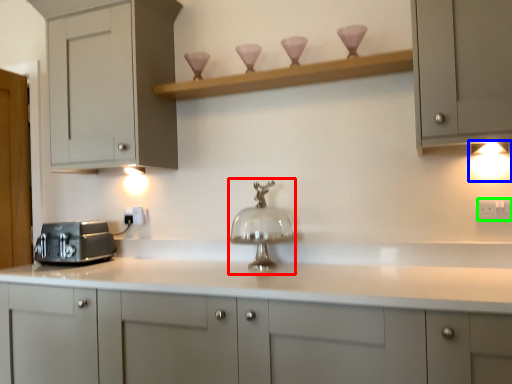
Question: Estimate the real-world distances between objects in this image. Which object is closer to faucet (highlighted by a red box), light fixture (highlighted by a blue box) or electric outlet (highlighted by a green box)?

Choices:
 (A) light fixture
 (B) electric outlet

Answer: (B)